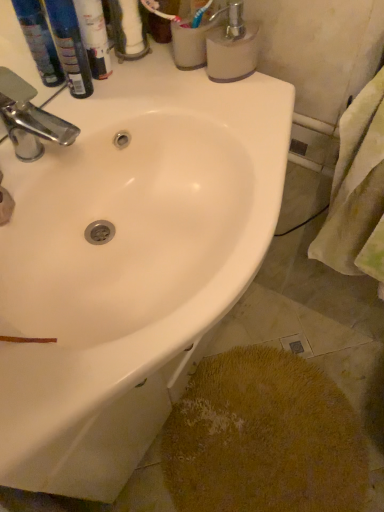
In order to face white glossy sink at upper center, should I rotate leftwards or rightwards?

You should rotate left by 10.471 degrees.

What do you see at coordinates (357, 191) in the screenshot?
I see `yellow fabric towel at right` at bounding box center [357, 191].

Where is `white matte soap dispenser at upper right`? The height and width of the screenshot is (512, 384). white matte soap dispenser at upper right is located at coordinates click(232, 46).

Where is `white matte toilet paper at upper center`? The image size is (384, 512). white matte toilet paper at upper center is located at coordinates (131, 28).

Find the location of a particular element. The height and width of the screenshot is (512, 384). white glossy sink at upper center is located at coordinates (129, 263).

From a real-world perspective, relative to white matte toilet paper at upper center, is yellow fabric towel at right vertically above or below?

yellow fabric towel at right is below white matte toilet paper at upper center.

Is white matte toilet paper at upper center located within yellow fabric towel at right?

Definitely not — white matte toilet paper at upper center is not inside yellow fabric towel at right.

Locate an element on the screen. The width and height of the screenshot is (384, 512). bath towel that is on the right side of white matte toilet paper at upper center is located at coordinates (357, 191).

In the scene shown: Between yellow fabric towel at right and white matte toilet paper at upper center, which one has larger size?

Bigger between the two is yellow fabric towel at right.

From a real-world perspective, which is physically below, white matte soap dispenser at upper right or white glossy tube at upper left, acting as the 2th toiletry starting from the left?

white matte soap dispenser at upper right is physically lower.

Is white matte soap dispenser at upper right smaller than white glossy tube at upper left, acting as the 2th toiletry starting from the left?

Incorrect, white matte soap dispenser at upper right is not smaller in size than white glossy tube at upper left, acting as the 2th toiletry starting from the left.

Considering the sizes of objects white matte soap dispenser at upper right and white glossy tube at upper left, acting as the 2th toiletry starting from the left, in the image provided, who is wider, white matte soap dispenser at upper right or white glossy tube at upper left, acting as the 2th toiletry starting from the left,?

With larger width is white matte soap dispenser at upper right.

How much distance is there between white matte soap dispenser at upper right and white glossy tube at upper left, acting as the 2th toiletry starting from the left?

white matte soap dispenser at upper right and white glossy tube at upper left, acting as the 2th toiletry starting from the left, are 8.81 inches apart.

Considering their positions, is white glossy tube at upper left, acting as the 2th toiletry starting from the left, located in front of or behind blue plastic bottles at upper left, marked as the first toiletry in a left-to-right arrangement?

white glossy tube at upper left, acting as the 2th toiletry starting from the left, is positioned closer to the viewer than blue plastic bottles at upper left, marked as the first toiletry in a left-to-right arrangement.

Considering the sizes of objects white glossy tube at upper left, acting as the 2th toiletry starting from the left, and blue plastic bottles at upper left, marked as the first toiletry in a left-to-right arrangement, in the image provided, who is shorter, white glossy tube at upper left, acting as the 2th toiletry starting from the left, or blue plastic bottles at upper left, marked as the first toiletry in a left-to-right arrangement,?

Standing shorter between the two is blue plastic bottles at upper left, marked as the first toiletry in a left-to-right arrangement.

From the image's perspective, is white glossy tube at upper left, placed as the 1th toiletry when sorted from right to left, located above or below blue plastic bottles at upper left, marked as the first toiletry in a left-to-right arrangement?

Clearly, from the image's perspective, white glossy tube at upper left, placed as the 1th toiletry when sorted from right to left, is above blue plastic bottles at upper left, marked as the first toiletry in a left-to-right arrangement.

Does white glossy tube at upper left, placed as the 1th toiletry when sorted from right to left, have a larger size compared to blue plastic bottles at upper left, marked as the first toiletry in a left-to-right arrangement?

Yes, white glossy tube at upper left, placed as the 1th toiletry when sorted from right to left, is bigger than blue plastic bottles at upper left, marked as the first toiletry in a left-to-right arrangement.

Can you tell me how much white glossy sink at upper center and white matte toilet paper at upper center differ in facing direction?

The angular difference between white glossy sink at upper center and white matte toilet paper at upper center is 37.9 degrees.

Between white glossy sink at upper center and white matte toilet paper at upper center, which one is positioned behind?

Positioned behind is white matte toilet paper at upper center.

Between white glossy sink at upper center and white matte toilet paper at upper center, which one has more height?

white glossy sink at upper center is taller.

In terms of width, does white glossy sink at upper center look wider or thinner when compared to white matte toilet paper at upper center?

In the image, white glossy sink at upper center appears to be wider than white matte toilet paper at upper center.

From the image's perspective, which one is positioned higher, yellow textured rug at lower right or white matte soap dispenser at upper right?

From the image's view, white matte soap dispenser at upper right is above.

Does yellow textured rug at lower right have a smaller size compared to white matte soap dispenser at upper right?

Incorrect, yellow textured rug at lower right is not smaller in size than white matte soap dispenser at upper right.

From a real-world perspective, who is located higher, yellow textured rug at lower right or white matte soap dispenser at upper right?

white matte soap dispenser at upper right, from a real-world perspective.

Between yellow textured rug at lower right and white matte soap dispenser at upper right, which one has less height?

Standing shorter between the two is yellow textured rug at lower right.

From a real-world perspective, which object rests below the other?

chrome metallic faucet at upper left is physically lower.

Is chrome metallic faucet at upper left in contact with white glossy tube at upper left, acting as the 2th toiletry starting from the left?

No, chrome metallic faucet at upper left is not next to white glossy tube at upper left, acting as the 2th toiletry starting from the left.

From the image's perspective, is chrome metallic faucet at upper left above or below white glossy tube at upper left, placed as the 1th toiletry when sorted from right to left?

chrome metallic faucet at upper left is situated lower than white glossy tube at upper left, placed as the 1th toiletry when sorted from right to left, in the image.

Is chrome metallic faucet at upper left taller or shorter than white glossy tube at upper left, placed as the 1th toiletry when sorted from right to left?

Considering their sizes, chrome metallic faucet at upper left has less height than white glossy tube at upper left, placed as the 1th toiletry when sorted from right to left.

How different are the orientations of yellow textured rug at lower right and yellow fabric towel at right in degrees?

92.1 degrees.

Is point (312, 389) positioned in front of point (315, 253)?

No, it is behind (315, 253).

Would you consider yellow textured rug at lower right to be distant from yellow fabric towel at right?

yellow textured rug at lower right is actually quite close to yellow fabric towel at right.

Can you confirm if yellow textured rug at lower right is positioned to the left of yellow fabric towel at right?

Yes, yellow textured rug at lower right is to the left of yellow fabric towel at right.

I want to click on bath towel that appears on the right of white matte toilet paper at upper center, so click(x=357, y=191).

Locate an element on the screen. Image resolution: width=384 pixels, height=512 pixels. the 2nd toiletry in front of the white matte soap dispenser at upper right, starting your count from the anchor is located at coordinates (94, 36).

Which object lies nearer to the anchor point white glossy tube at upper left, acting as the 2th toiletry starting from the left, white matte toilet paper at upper center or yellow fabric towel at right?

white matte toilet paper at upper center.

When comparing their distances from yellow fabric towel at right, does yellow textured rug at lower right or white glossy sink at upper center seem further?

Based on the image, yellow textured rug at lower right appears to be further to yellow fabric towel at right.

Estimate the real-world distances between objects in this image. Which object is closer to yellow textured rug at lower right, white glossy sink at upper center or white matte soap dispenser at upper right?

Among the two, white glossy sink at upper center is located nearer to yellow textured rug at lower right.

Which object lies nearer to the anchor point white glossy sink at upper center, white glossy tube at upper left, acting as the 2th toiletry starting from the left, or blue plastic bottles at upper left, which is the 2th toiletry in right-to-left order?

Among the two, blue plastic bottles at upper left, which is the 2th toiletry in right-to-left order, is located nearer to white glossy sink at upper center.

When comparing their distances from white matte toilet paper at upper center, does yellow fabric towel at right or blue plastic bottles at upper left, marked as the first toiletry in a left-to-right arrangement, seem closer?

blue plastic bottles at upper left, marked as the first toiletry in a left-to-right arrangement, is closer to white matte toilet paper at upper center.

Looking at the image, which one is located further to white matte toilet paper at upper center, white matte soap dispenser at upper right or blue plastic bottles at upper left, marked as the first toiletry in a left-to-right arrangement?

white matte soap dispenser at upper right lies further to white matte toilet paper at upper center than the other object.

Which object lies nearer to the anchor point white glossy tube at upper left, acting as the 2th toiletry starting from the left, chrome metallic faucet at upper left or white matte toilet paper at upper center?

white matte toilet paper at upper center.

When comparing their distances from yellow textured rug at lower right, does yellow fabric towel at right or chrome metallic faucet at upper left seem further?

chrome metallic faucet at upper left is further to yellow textured rug at lower right.

The image size is (384, 512). I want to click on sink between yellow fabric towel at right and yellow textured rug at lower right in the vertical direction, so click(x=129, y=263).

In order to click on toilet paper located between white glossy sink at upper center and yellow fabric towel at right in the left-right direction in this screenshot , I will do click(131, 28).

Where is `toiletry between white matte soap dispenser at upper right and white glossy sink at upper center from top to bottom`? toiletry between white matte soap dispenser at upper right and white glossy sink at upper center from top to bottom is located at coordinates (70, 47).

What are the coordinates of `toilet paper between chrome metallic faucet at upper left and yellow fabric towel at right in the horizontal direction` in the screenshot? It's located at point(131,28).